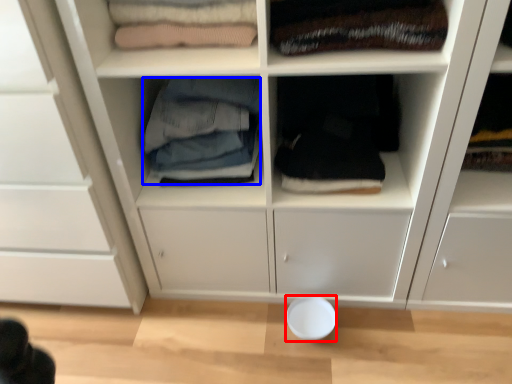
Question: Which object is further to the camera taking this photo, bowl (highlighted by a red box) or clothing (highlighted by a blue box)?

Choices:
 (A) bowl
 (B) clothing

Answer: (A)